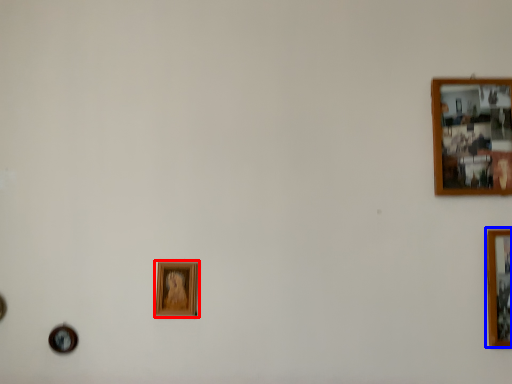
Question: Which point is closer to the camera, picture frame (highlighted by a red box) or picture frame (highlighted by a blue box)?

Choices:
 (A) picture frame
 (B) picture frame

Answer: (B)